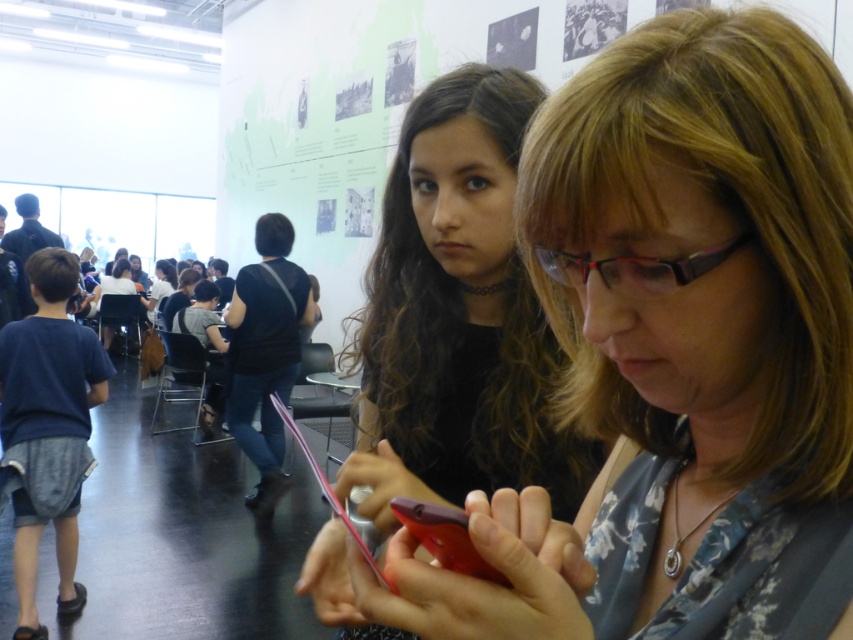
Question: Does matte black phone at center appear over matte black shirt at center?

Choices:
 (A) no
 (B) yes

Answer: (B)

Question: Estimate the real-world distances between objects in this image. Which object is farther from the rubberized red phone at center?

Choices:
 (A) matte black phone at center
 (B) matte black shirt at center

Answer: (B)

Question: Observing the image, what is the correct spatial positioning of matte black shirt at center in reference to rubberized red phone at center?

Choices:
 (A) left
 (B) right

Answer: (B)

Question: Which point is farther from the camera taking this photo?

Choices:
 (A) [x=413, y=500]
 (B) [x=544, y=481]
 (C) [x=355, y=573]

Answer: (B)

Question: Among these points, which one is nearest to the camera?

Choices:
 (A) (833, 432)
 (B) (360, 387)
 (C) (416, 502)

Answer: (C)

Question: Does matte black shirt at center have a larger size compared to rubberized red phone at center?

Choices:
 (A) yes
 (B) no

Answer: (A)